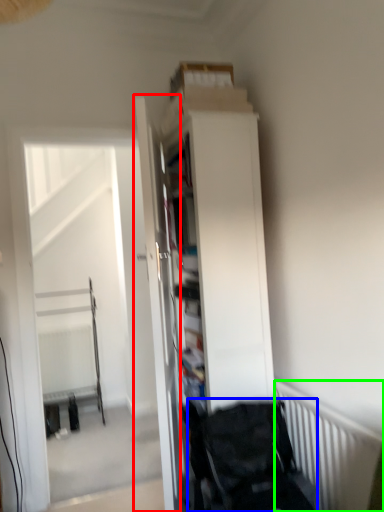
Question: Based on their relative distances, which object is farther from door (highlighted by a red box)? Choose from baby carriage (highlighted by a blue box) and radiator (highlighted by a green box).

Choices:
 (A) baby carriage
 (B) radiator

Answer: (B)